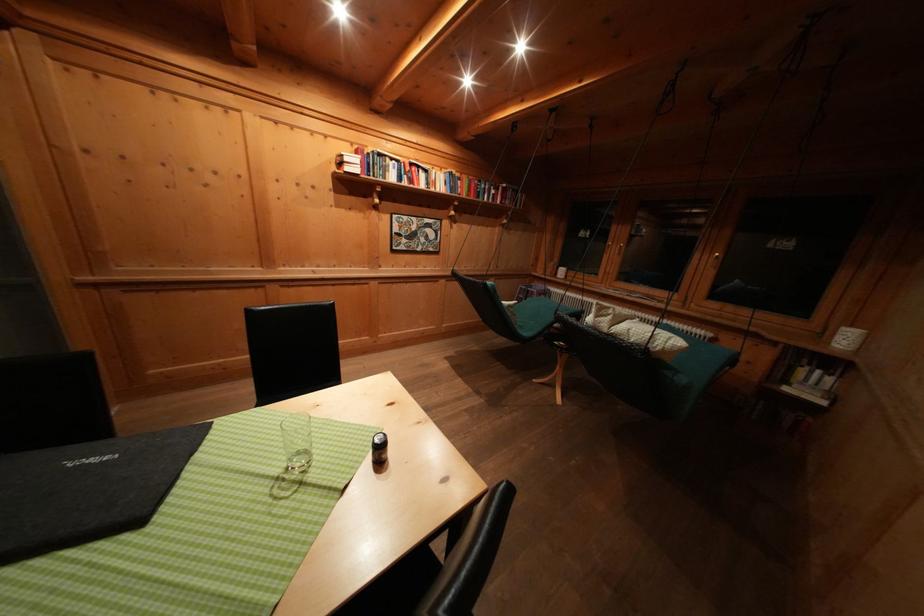
Where is `hanging chair sitting surface`? The height and width of the screenshot is (616, 924). hanging chair sitting surface is located at coordinates (537, 314).